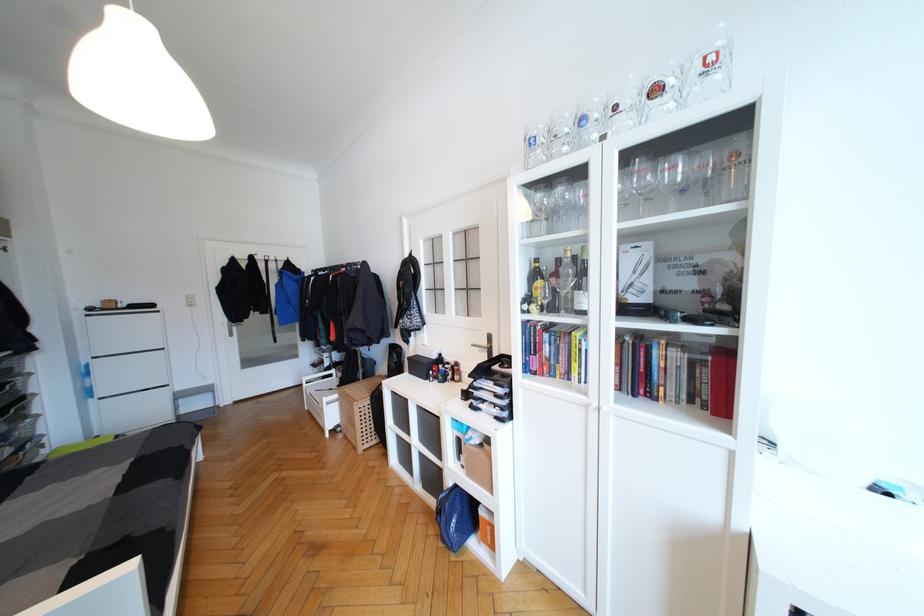
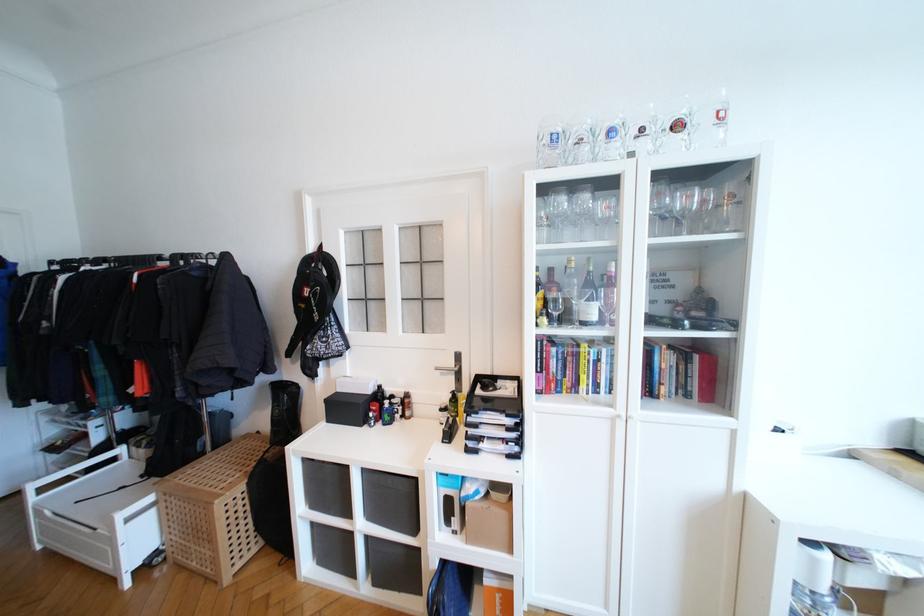
Locate, in the second image, the point that corresponds to point (488, 344) in the first image.

(455, 363)